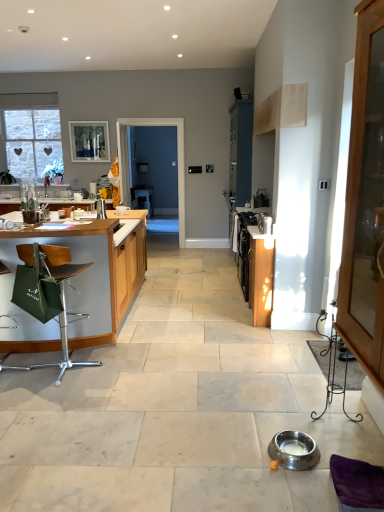
I want to click on vacant space behind stainless steel bowl at lower center, positioned as the first appliance in front-to-back order, so click(x=278, y=423).